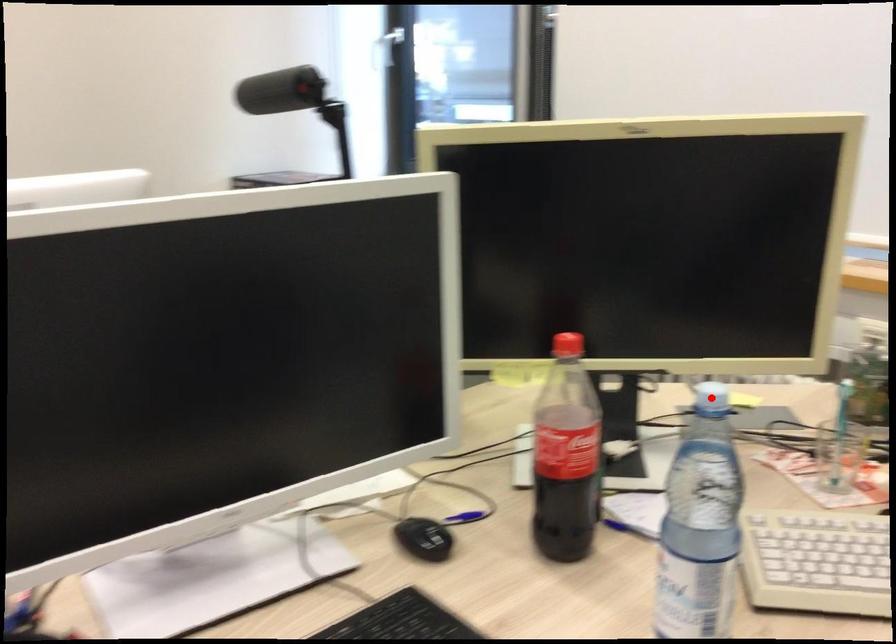
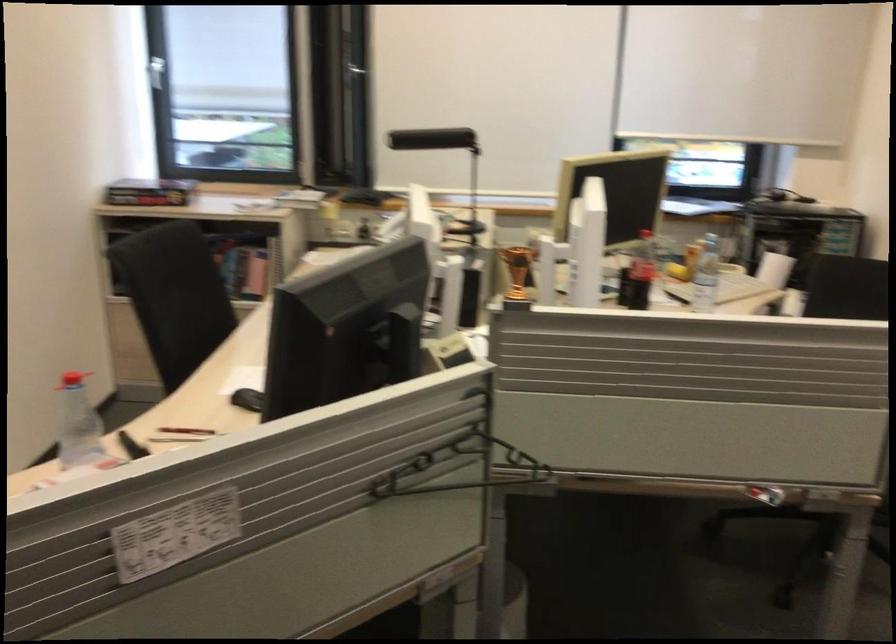
Locate, in the second image, the point that corresponds to the highlighted location in the first image.

(702, 232)